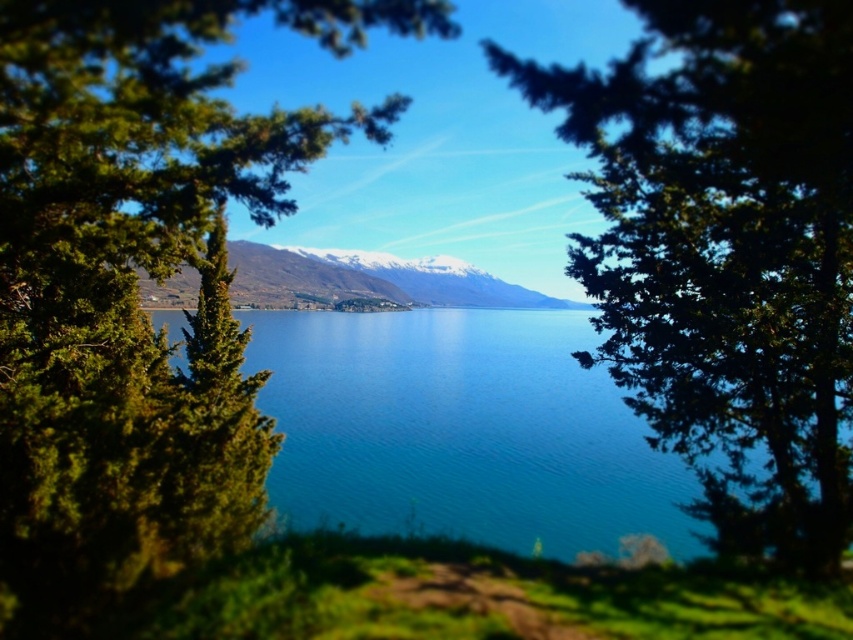
Question: Which point appears farthest from the camera in this image?

Choices:
 (A) (364, 321)
 (B) (320, 262)
 (C) (137, 582)
 (D) (694, 188)

Answer: (B)

Question: Is blue glassy water at center behind snowy mountain at center?

Choices:
 (A) no
 (B) yes

Answer: (B)

Question: Can you confirm if green leafy tree at center is positioned below blue glassy water at center?

Choices:
 (A) no
 (B) yes

Answer: (A)

Question: Which of the following is the closest to the observer?

Choices:
 (A) snowy mountain at center
 (B) green leafy tree at center

Answer: (B)

Question: Which of the following is the closest to the observer?

Choices:
 (A) (173, 442)
 (B) (589, 413)
 (C) (608, 202)
 (D) (346, 280)

Answer: (C)

Question: Can you confirm if green leafy tree at upper center is positioned to the right of snowy mountain at center?

Choices:
 (A) yes
 (B) no

Answer: (A)